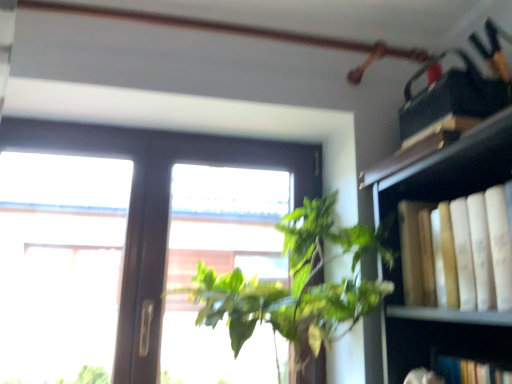
Question: From a real-world perspective, is transparent glass window at center positioned over yellow paper book at right based on gravity?

Choices:
 (A) no
 (B) yes

Answer: (B)

Question: Considering the relative positions of transparent glass window at center and yellow paper book at right in the image provided, is transparent glass window at center to the right of yellow paper book at right from the viewer's perspective?

Choices:
 (A) yes
 (B) no

Answer: (B)

Question: Are transparent glass window at center and yellow paper book at right far apart?

Choices:
 (A) no
 (B) yes

Answer: (A)

Question: Is transparent glass window at center behind yellow paper book at right?

Choices:
 (A) yes
 (B) no

Answer: (A)

Question: Is transparent glass window at center positioned with its back to yellow paper book at right?

Choices:
 (A) no
 (B) yes

Answer: (A)

Question: Considering the positions of point (33, 120) and point (215, 279), is point (33, 120) closer or farther from the camera than point (215, 279)?

Choices:
 (A) closer
 (B) farther

Answer: (B)

Question: From their relative heights in the image, would you say transparent glass window at center is taller or shorter than green leafy plant at center?

Choices:
 (A) short
 (B) tall

Answer: (B)

Question: In the image, is transparent glass window at center positioned in front of or behind green leafy plant at center?

Choices:
 (A) front
 (B) behind

Answer: (B)

Question: From a real-world perspective, is transparent glass window at center positioned above or below green leafy plant at center?

Choices:
 (A) above
 (B) below

Answer: (A)

Question: Which is correct: transparent glass window at center is inside yellow paper book at right, or outside of it?

Choices:
 (A) inside
 (B) outside

Answer: (B)

Question: From the image's perspective, is transparent glass window at center located above or below yellow paper book at right?

Choices:
 (A) below
 (B) above

Answer: (A)

Question: Would you say transparent glass window at center is to the left or to the right of yellow paper book at right in the picture?

Choices:
 (A) left
 (B) right

Answer: (A)

Question: Considering the positions of point (164, 145) and point (477, 279), is point (164, 145) closer or farther from the camera than point (477, 279)?

Choices:
 (A) closer
 (B) farther

Answer: (B)

Question: From the image's perspective, is yellow paper book at right located above or below green leafy plant at center?

Choices:
 (A) below
 (B) above

Answer: (B)

Question: In terms of size, does yellow paper book at right appear bigger or smaller than green leafy plant at center?

Choices:
 (A) small
 (B) big

Answer: (A)